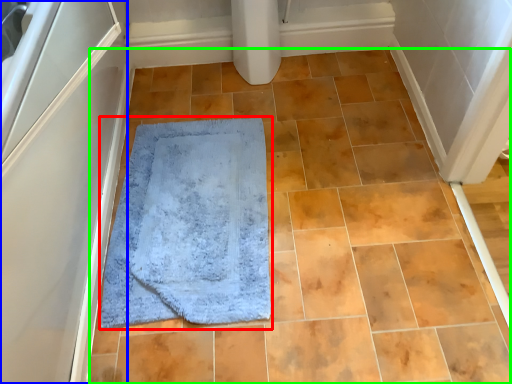
Question: Estimate the real-world distances between objects in this image. Which object is farther from bath mat (highlighted by a red box), screen door (highlighted by a blue box) or ceramic tile (highlighted by a green box)?

Choices:
 (A) screen door
 (B) ceramic tile

Answer: (A)